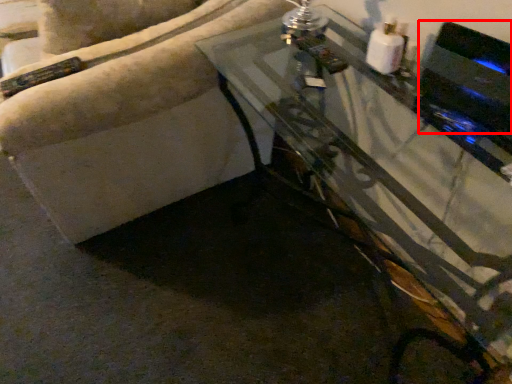
Question: From the image's perspective, what is the correct spatial relationship of appliance (annotated by the red box) in relation to table?

Choices:
 (A) above
 (B) below

Answer: (A)